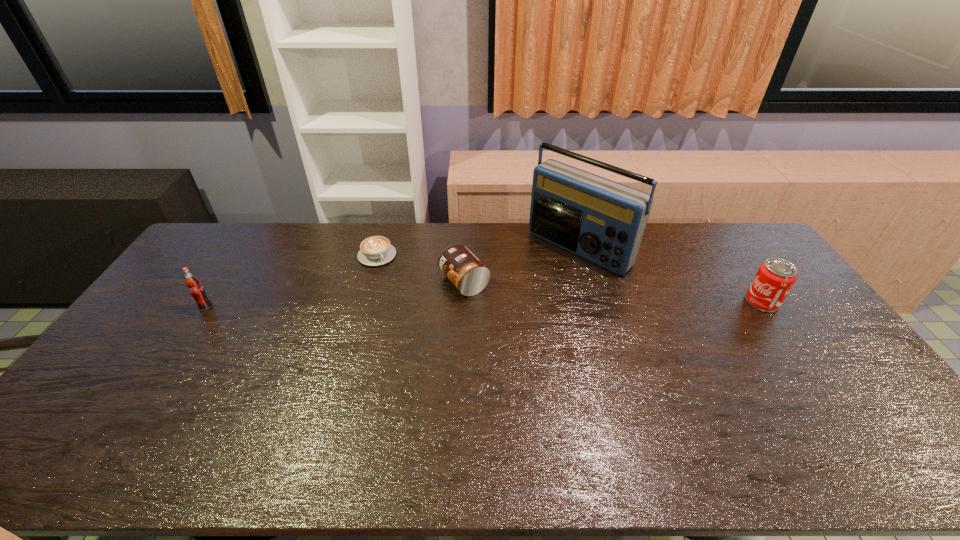
Where is `the leftmost object`? the leftmost object is located at coordinates (193, 284).

This screenshot has height=540, width=960. I want to click on the taller can, so click(x=775, y=277).

What are the coordinates of `the right can` in the screenshot? It's located at (775, 277).

At what (x,y) coordinates should I click in order to perform the action: click on the tallest object. Please return your answer as a coordinate pair (x, y). Image resolution: width=960 pixels, height=540 pixels. Looking at the image, I should click on (603, 221).

The height and width of the screenshot is (540, 960). Identify the location of radio receiver. (603, 221).

Find the location of `the shortest object`. the shortest object is located at coordinates (377, 250).

Image resolution: width=960 pixels, height=540 pixels. Find the location of `the fourth object from right to left`. the fourth object from right to left is located at coordinates (377, 250).

In order to click on the second shortest object in this screenshot , I will do `click(469, 275)`.

The width and height of the screenshot is (960, 540). Identify the location of the third object from right to left. (469, 275).

The image size is (960, 540). I want to click on blank space located on the label of the leftmost object, so click(132, 416).